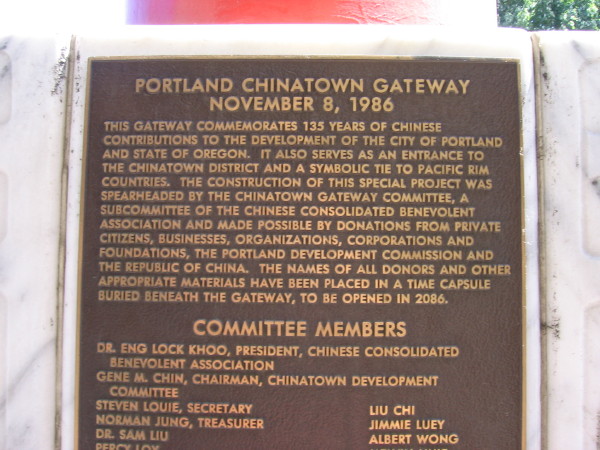
The width and height of the screenshot is (600, 450). I want to click on dirty grout, so click(x=61, y=273), click(x=541, y=247).